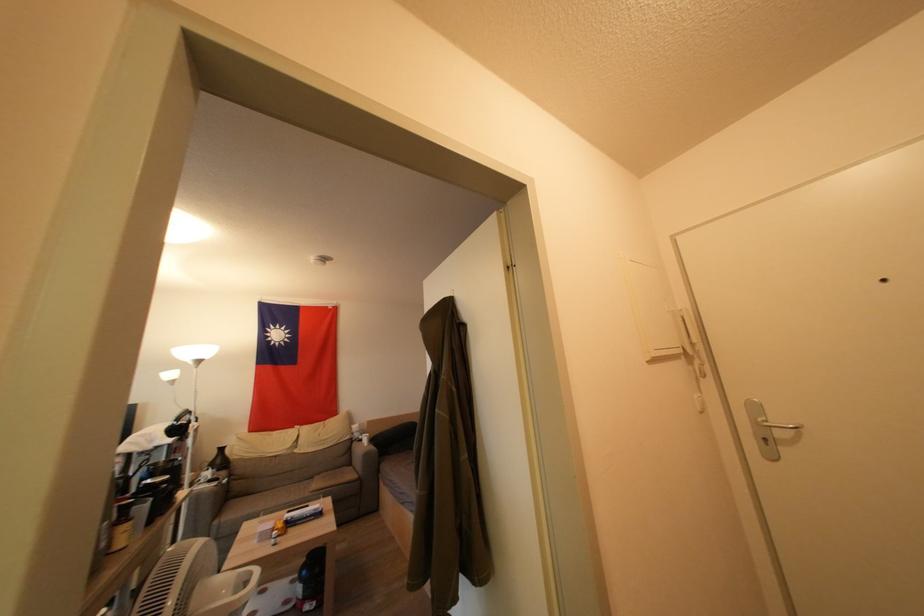
Find where to lift the black vase. Please return your answer as a coordinate pair (x, y).

(220, 460)